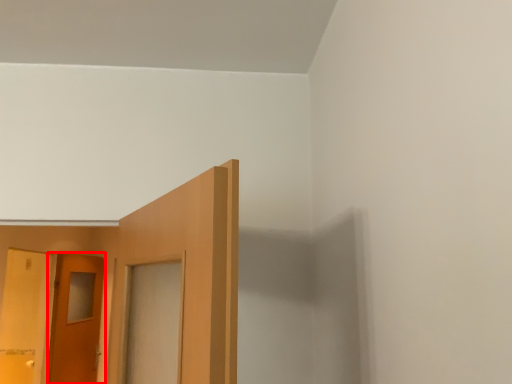
Question: Observing the image, what is the correct spatial positioning of door (annotated by the red box) in reference to door?

Choices:
 (A) left
 (B) right

Answer: (B)